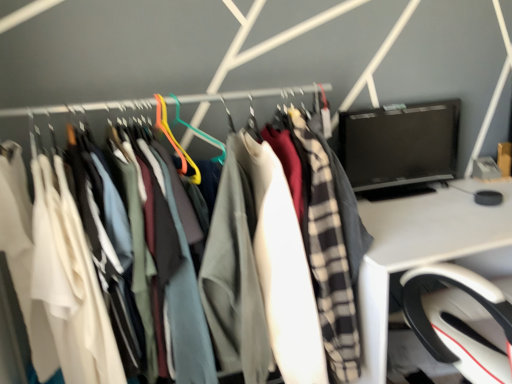
Question: Is black glossy monitor at upper right smaller than matte fabric clothes at left?

Choices:
 (A) no
 (B) yes

Answer: (B)

Question: Does black glossy monitor at upper right touch matte fabric clothes at left?

Choices:
 (A) yes
 (B) no

Answer: (B)

Question: From the image's perspective, does black glossy monitor at upper right appear lower than matte fabric clothes at left?

Choices:
 (A) yes
 (B) no

Answer: (B)

Question: From a real-world perspective, is black glossy monitor at upper right located beneath matte fabric clothes at left?

Choices:
 (A) no
 (B) yes

Answer: (A)

Question: Is black glossy monitor at upper right wider than matte fabric clothes at left?

Choices:
 (A) no
 (B) yes

Answer: (A)

Question: Is black glossy monitor at upper right aimed at matte fabric clothes at left?

Choices:
 (A) no
 (B) yes

Answer: (A)

Question: Does black glossy monitor at upper right have a greater height compared to white glossy desk at right?

Choices:
 (A) no
 (B) yes

Answer: (A)

Question: Is the surface of black glossy monitor at upper right in direct contact with white glossy desk at right?

Choices:
 (A) no
 (B) yes

Answer: (A)

Question: Is black glossy monitor at upper right not near white glossy desk at right?

Choices:
 (A) no
 (B) yes

Answer: (A)

Question: Considering the relative sizes of black glossy monitor at upper right and white glossy desk at right in the image provided, is black glossy monitor at upper right smaller than white glossy desk at right?

Choices:
 (A) no
 (B) yes

Answer: (B)

Question: Is black glossy monitor at upper right oriented away from white glossy desk at right?

Choices:
 (A) yes
 (B) no

Answer: (B)

Question: Is black glossy monitor at upper right further to camera compared to white glossy desk at right?

Choices:
 (A) no
 (B) yes

Answer: (B)

Question: Considering the relative sizes of matte fabric clothes at left and black glossy monitor at upper right in the image provided, is matte fabric clothes at left shorter than black glossy monitor at upper right?

Choices:
 (A) no
 (B) yes

Answer: (A)